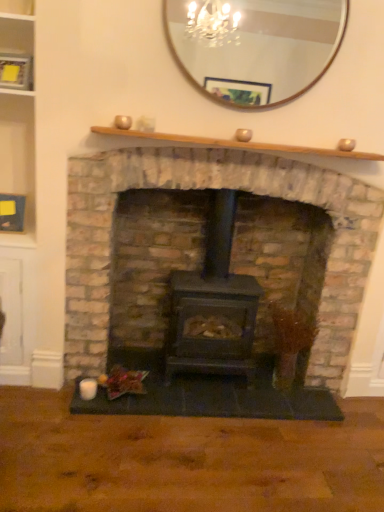
At what (x,y) coordinates should I click in order to perform the action: click on free space on the front side of black matte wood burning stove at center. Please return your answer as a coordinate pair (x, y). The image size is (384, 512). Looking at the image, I should click on (197, 403).